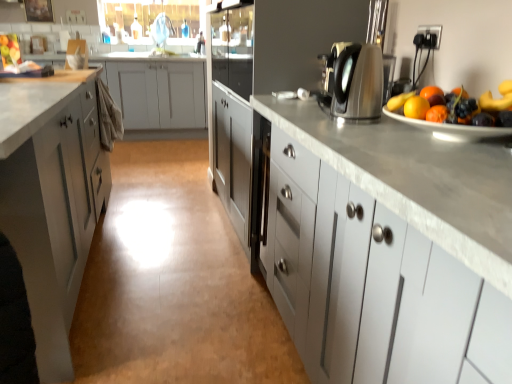
Question: Is white matte cabinet at left, the second cabinetry when ordered from back to front, aimed at white matte cabinet at left, the first cabinetry from the back?

Choices:
 (A) yes
 (B) no

Answer: (B)

Question: Does white matte cabinet at left, the second cabinetry when ordered from back to front, come behind white matte cabinet at left, the 3th cabinetry positioned from the front?

Choices:
 (A) no
 (B) yes

Answer: (A)

Question: Is white matte cabinet at left, the second cabinetry when ordered from back to front, shorter than white matte cabinet at left, marked as the first cabinetry in a left-to-right arrangement?

Choices:
 (A) yes
 (B) no

Answer: (B)

Question: Can you confirm if white matte cabinet at left, positioned as the 2th cabinetry in right-to-left order, is wider than white matte cabinet at left, the first cabinetry from the back?

Choices:
 (A) yes
 (B) no

Answer: (A)

Question: From the image's perspective, is white matte cabinet at left, positioned as the 2th cabinetry in right-to-left order, below white matte cabinet at left, the 3th cabinetry positioned from the front?

Choices:
 (A) no
 (B) yes

Answer: (B)

Question: Based on their positions, is white matte cabinet at left, the 3th cabinetry positioned from the front, located to the left or right of white glossy sink at upper center?

Choices:
 (A) right
 (B) left

Answer: (B)

Question: Considering their positions, is white matte cabinet at left, which is the third cabinetry in right-to-left order, located in front of or behind white glossy sink at upper center?

Choices:
 (A) behind
 (B) front

Answer: (B)

Question: From a real-world perspective, is white matte cabinet at left, marked as the first cabinetry in a left-to-right arrangement, physically located above or below white glossy sink at upper center?

Choices:
 (A) above
 (B) below

Answer: (B)

Question: Is white matte cabinet at left, which is the third cabinetry in right-to-left order, taller or shorter than white glossy sink at upper center?

Choices:
 (A) tall
 (B) short

Answer: (A)

Question: From a real-world perspective, is shiny ceramic plate at right above or below white matte cabinet at left, positioned as the 2th cabinetry in right-to-left order?

Choices:
 (A) below
 (B) above

Answer: (B)

Question: Is shiny ceramic plate at right to the left or to the right of white matte cabinet at left, positioned as the 2th cabinetry in right-to-left order, in the image?

Choices:
 (A) left
 (B) right

Answer: (B)

Question: In terms of height, does shiny ceramic plate at right look taller or shorter compared to white matte cabinet at left, positioned as the 2th cabinetry in right-to-left order?

Choices:
 (A) short
 (B) tall

Answer: (A)

Question: From the image's perspective, is shiny ceramic plate at right positioned above or below white matte cabinet at left, positioned as the 2th cabinetry in right-to-left order?

Choices:
 (A) above
 (B) below

Answer: (A)

Question: Visually, is white matte cabinet at left, the first cabinetry from the back, positioned to the left or to the right of satin silver kettle at upper right?

Choices:
 (A) right
 (B) left

Answer: (B)

Question: Based on their sizes in the image, would you say white matte cabinet at left, marked as the first cabinetry in a left-to-right arrangement, is bigger or smaller than satin silver kettle at upper right?

Choices:
 (A) big
 (B) small

Answer: (A)